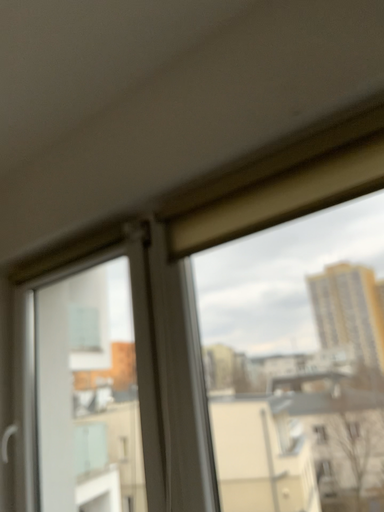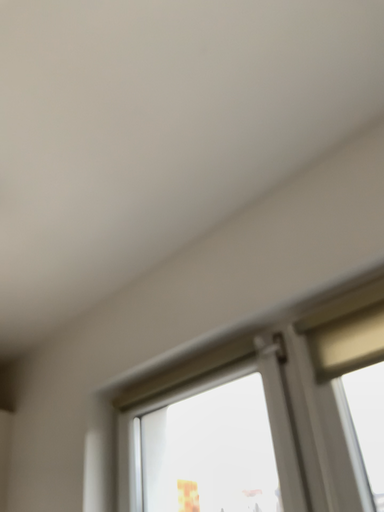
Question: Which way did the camera rotate in the video?

Choices:
 (A) rotated left
 (B) rotated right

Answer: (A)